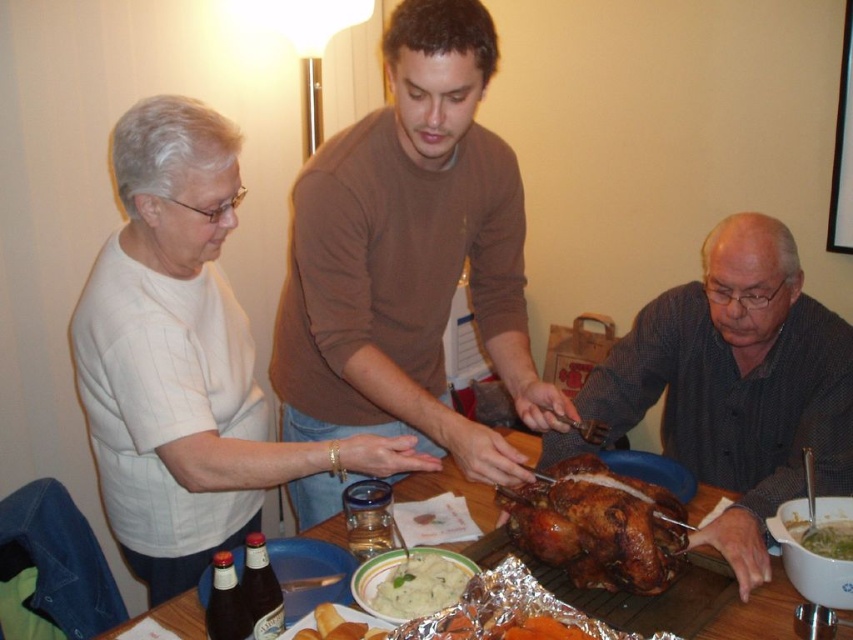
Between point (717, 620) and point (344, 614), which one is positioned in front?

Point (344, 614) is in front.

Is wooden table at center smaller than golden crispy bread at center?

No, wooden table at center is not smaller than golden crispy bread at center.

Describe the element at coordinates (741, 604) in the screenshot. I see `wooden table at center` at that location.

What are the coordinates of `wooden table at center` in the screenshot? It's located at (741, 604).

Can you confirm if brown sweater at center is positioned below golden crispy bread at center?

No, brown sweater at center is not below golden crispy bread at center.

Does brown sweater at center have a larger size compared to golden crispy bread at center?

Yes.

What do you see at coordinates (410, 257) in the screenshot? I see `brown sweater at center` at bounding box center [410, 257].

Identify the location of brown sweater at center. (410, 257).

Does golden brown roasted turkey at center have a smaller size compared to wooden table at center?

Yes.

This screenshot has height=640, width=853. In order to click on golden brown roasted turkey at center in this screenshot , I will do `click(598, 525)`.